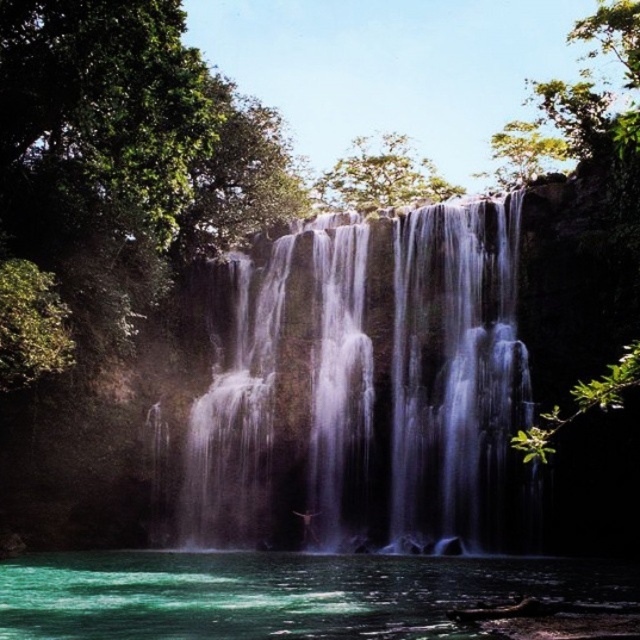
You are a photographer planning to capture the waterfall and the pool below. Based on the scene, which object is located above the other between the white silky waterfall at center and the green translucent water at lower center?

The white silky waterfall at center is positioned over the green translucent water at lower center, meaning the waterfall is above the pool.

You are a photographer positioned at the origin point of the coordinate system. You want to capture the white silky waterfall at center in your shot. What are the coordinates where you should aim your camera?

The white silky waterfall at center is located at coordinates point (358, 394), so you should aim your camera at those coordinates to capture it.

You are standing at the edge of the waterfall and want to locate the green translucent water at lower center. Based on the coordinates provided, where should you look relative to your position?

The green translucent water at lower center is located at coordinates point (300, 595), so you should look to the lower center direction from your current position at the edge of the waterfall.